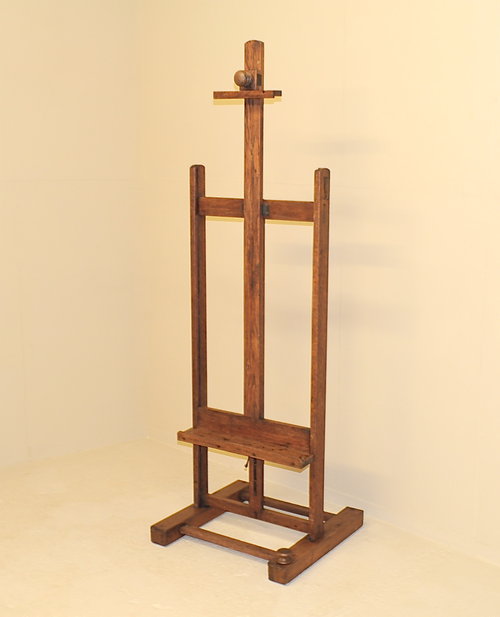
What are the coordinates of `board` in the screenshot? It's located at (195, 242), (253, 360), (315, 379), (276, 516), (243, 551), (298, 507), (305, 549), (187, 511).